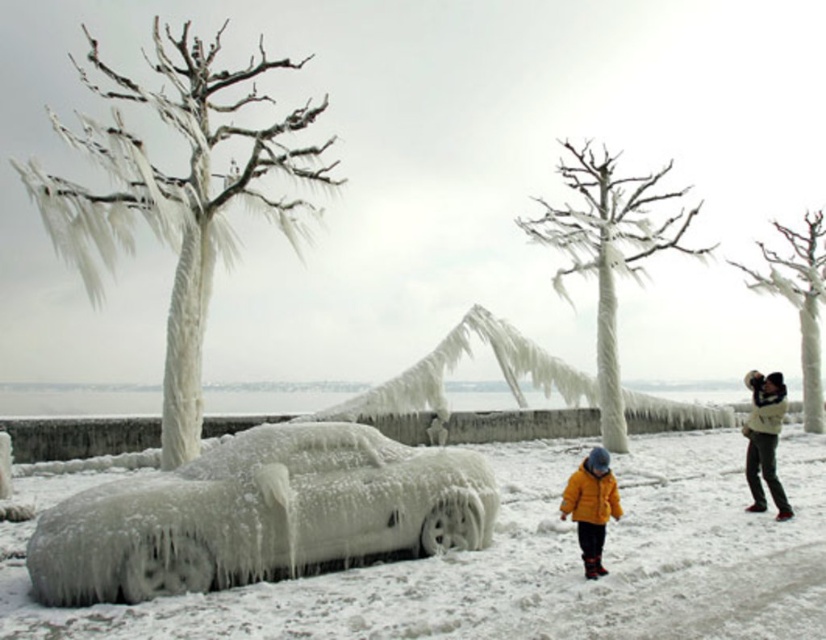
Question: Is white frosty snow at center bigger than white frosty tree at upper right?

Choices:
 (A) yes
 (B) no

Answer: (A)

Question: Among these points, which one is nearest to the camera?

Choices:
 (A) (651, 237)
 (B) (300, 230)
 (C) (774, 221)

Answer: (B)

Question: Which is farther from the orange fuzzy coat at lower center?

Choices:
 (A) white frosty tree at upper right
 (B) white woolen sweater at upper right
 (C) icy white tree at left

Answer: (A)

Question: Does white frosty tree at upper right appear on the left side of orange fuzzy coat at lower center?

Choices:
 (A) yes
 (B) no

Answer: (B)

Question: Estimate the real-world distances between objects in this image. Which object is closer to the white frosty snow at center?

Choices:
 (A) white fleece jacket at right
 (B) icy white tree at left
 (C) white woolen sweater at upper right

Answer: (C)

Question: Can you confirm if white woolen sweater at upper right is thinner than white fleece jacket at right?

Choices:
 (A) no
 (B) yes

Answer: (B)